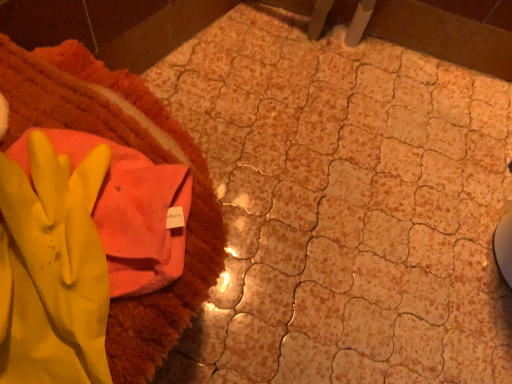
Question: Is orange terry cloth towel at upper left spatially inside yellow rubber glove at left, or outside of it?

Choices:
 (A) inside
 (B) outside

Answer: (B)

Question: Considering the positions of orange terry cloth towel at upper left and yellow rubber glove at left in the image, is orange terry cloth towel at upper left bigger or smaller than yellow rubber glove at left?

Choices:
 (A) big
 (B) small

Answer: (A)

Question: In terms of height, does orange terry cloth towel at upper left look taller or shorter compared to yellow rubber glove at left?

Choices:
 (A) tall
 (B) short

Answer: (A)

Question: Is yellow rubber glove at left in front of or behind orange terry cloth towel at upper left in the image?

Choices:
 (A) front
 (B) behind

Answer: (A)

Question: From their relative heights in the image, would you say yellow rubber glove at left is taller or shorter than orange terry cloth towel at upper left?

Choices:
 (A) tall
 (B) short

Answer: (B)

Question: From a real-world perspective, is yellow rubber glove at left above or below orange terry cloth towel at upper left?

Choices:
 (A) below
 (B) above

Answer: (B)

Question: Does point (71, 306) appear closer or farther from the camera than point (134, 82)?

Choices:
 (A) closer
 (B) farther

Answer: (A)